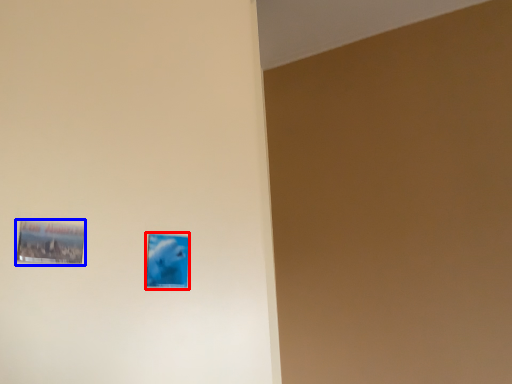
Question: Which of the following is the closest to the observer, picture frame (highlighted by a red box) or picture frame (highlighted by a blue box)?

Choices:
 (A) picture frame
 (B) picture frame

Answer: (B)